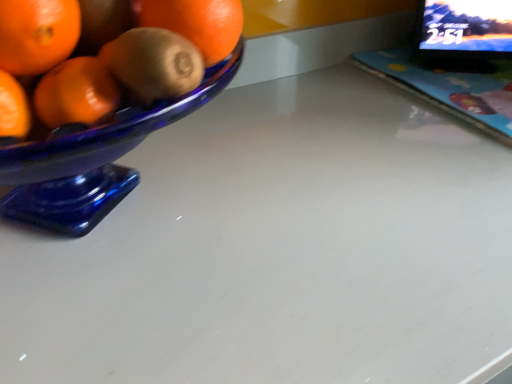
Where is `matte plastic laptop at upper right`? matte plastic laptop at upper right is located at coordinates (457, 62).

The image size is (512, 384). Describe the element at coordinates (457, 62) in the screenshot. I see `matte plastic laptop at upper right` at that location.

This screenshot has width=512, height=384. Describe the element at coordinates (463, 33) in the screenshot. I see `black glossy computer monitor at upper right` at that location.

Identify the location of black glossy computer monitor at upper right. The height and width of the screenshot is (384, 512). (463, 33).

What are the coordinates of `matte plastic laptop at upper right` in the screenshot? It's located at (457, 62).

Is matte plastic laptop at upper right at the left side of black glossy computer monitor at upper right?

In fact, matte plastic laptop at upper right is to the right of black glossy computer monitor at upper right.

Based on the photo, which object is more forward, matte plastic laptop at upper right or black glossy computer monitor at upper right?

matte plastic laptop at upper right is closer to the camera.

Is point (415, 49) positioned after point (463, 19)?

Yes, point (415, 49) is behind point (463, 19).

From the image's perspective, is matte plastic laptop at upper right located above black glossy computer monitor at upper right?

No, from the image's perspective, matte plastic laptop at upper right is not over black glossy computer monitor at upper right.

From a real-world perspective, which is physically below, matte plastic laptop at upper right or black glossy computer monitor at upper right?

matte plastic laptop at upper right is physically lower.

Which of these two, matte plastic laptop at upper right or black glossy computer monitor at upper right, is thinner?

With smaller width is black glossy computer monitor at upper right.

Who is shorter, matte plastic laptop at upper right or black glossy computer monitor at upper right?

matte plastic laptop at upper right is shorter.

Looking at this image, which of these two, matte plastic laptop at upper right or black glossy computer monitor at upper right, is bigger?

With larger size is black glossy computer monitor at upper right.

Would you say matte plastic laptop at upper right is outside black glossy computer monitor at upper right?

That's correct, matte plastic laptop at upper right is outside of black glossy computer monitor at upper right.

Is matte plastic laptop at upper right touching black glossy computer monitor at upper right?

Indeed, matte plastic laptop at upper right and black glossy computer monitor at upper right are beside each other and touching.

Is matte plastic laptop at upper right turned away from black glossy computer monitor at upper right?

matte plastic laptop at upper right does not have its back to black glossy computer monitor at upper right.

What's the angular difference between matte plastic laptop at upper right and black glossy computer monitor at upper right's facing directions?

matte plastic laptop at upper right and black glossy computer monitor at upper right are facing 34.4 degrees away from each other.

How far apart are matte plastic laptop at upper right and black glossy computer monitor at upper right?

matte plastic laptop at upper right is 1.91 inches from black glossy computer monitor at upper right.

Locate an element on the screen. laptop in front of the black glossy computer monitor at upper right is located at coordinates (457, 62).

Is black glossy computer monitor at upper right to the left of matte plastic laptop at upper right from the viewer's perspective?

Yes, black glossy computer monitor at upper right is to the left of matte plastic laptop at upper right.

Is black glossy computer monitor at upper right closer to the viewer compared to matte plastic laptop at upper right?

No, it is behind matte plastic laptop at upper right.

Which is closer to the camera, (492,9) or (381,71)?

Point (492,9) is closer to the camera than point (381,71).

From the picture: From the image's perspective, which object appears higher, black glossy computer monitor at upper right or matte plastic laptop at upper right?

From the image's view, black glossy computer monitor at upper right is above.

From a real-world perspective, between black glossy computer monitor at upper right and matte plastic laptop at upper right, who is vertically higher?

black glossy computer monitor at upper right.

Can you confirm if black glossy computer monitor at upper right is thinner than matte plastic laptop at upper right?

Correct, the width of black glossy computer monitor at upper right is less than that of matte plastic laptop at upper right.

Who is taller, black glossy computer monitor at upper right or matte plastic laptop at upper right?

With more height is black glossy computer monitor at upper right.

Considering the relative sizes of black glossy computer monitor at upper right and matte plastic laptop at upper right in the image provided, is black glossy computer monitor at upper right smaller than matte plastic laptop at upper right?

Incorrect, black glossy computer monitor at upper right is not smaller in size than matte plastic laptop at upper right.

Would you say black glossy computer monitor at upper right is inside or outside matte plastic laptop at upper right?

black glossy computer monitor at upper right cannot be found inside matte plastic laptop at upper right.

From the picture: Are black glossy computer monitor at upper right and matte plastic laptop at upper right far apart?

No, there isn't a large distance between black glossy computer monitor at upper right and matte plastic laptop at upper right.

Is black glossy computer monitor at upper right aimed at matte plastic laptop at upper right?

Yes, black glossy computer monitor at upper right is oriented towards matte plastic laptop at upper right.

What's the angular difference between black glossy computer monitor at upper right and matte plastic laptop at upper right's facing directions?

black glossy computer monitor at upper right and matte plastic laptop at upper right are facing 34.4 degrees away from each other.

Where is `computer monitor behind the matte plastic laptop at upper right`? This screenshot has width=512, height=384. computer monitor behind the matte plastic laptop at upper right is located at coordinates (463, 33).

Identify the location of laptop on the right of black glossy computer monitor at upper right. The width and height of the screenshot is (512, 384). (457, 62).

In the image, there is a black glossy computer monitor at upper right. Find the location of `laptop below it (from the image's perspective)`. laptop below it (from the image's perspective) is located at coordinates (457, 62).